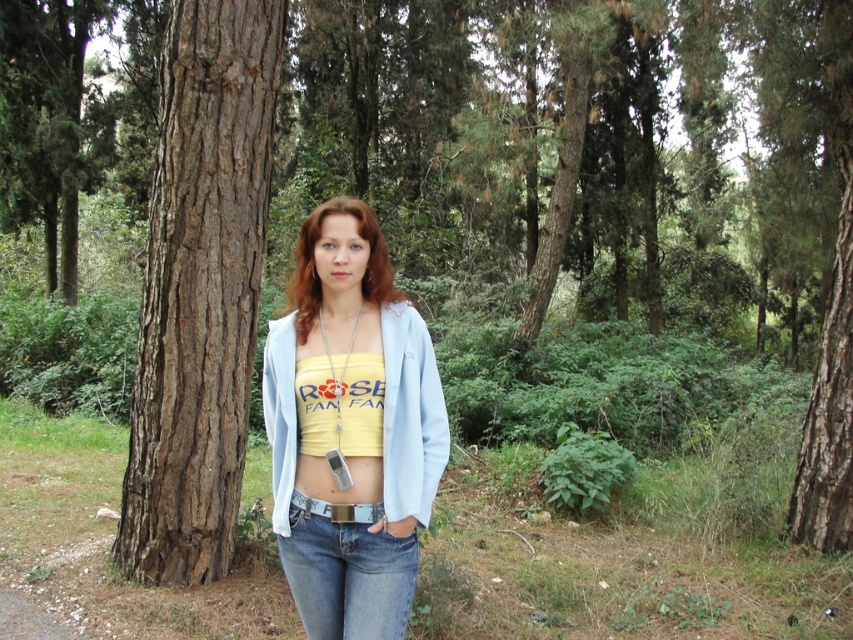
Question: Which object is closer to the camera taking this photo?

Choices:
 (A) denim at center
 (B) brown rough bark tree at left
 (C) yellow fabric top at center

Answer: (A)

Question: Where is yellow fabric top at center located in relation to denim at center in the image?

Choices:
 (A) right
 (B) left

Answer: (A)

Question: Considering the real-world distances, which object is farthest from the brown rough bark tree at left?

Choices:
 (A) yellow fabric top at center
 (B) denim at center

Answer: (B)

Question: Among these objects, which one is farthest from the camera?

Choices:
 (A) brown rough bark tree at left
 (B) denim at center
 (C) yellow fabric top at center

Answer: (A)

Question: Can you confirm if yellow fabric top at center is smaller than denim at center?

Choices:
 (A) yes
 (B) no

Answer: (B)

Question: Is brown rough bark tree at left below denim at center?

Choices:
 (A) no
 (B) yes

Answer: (A)